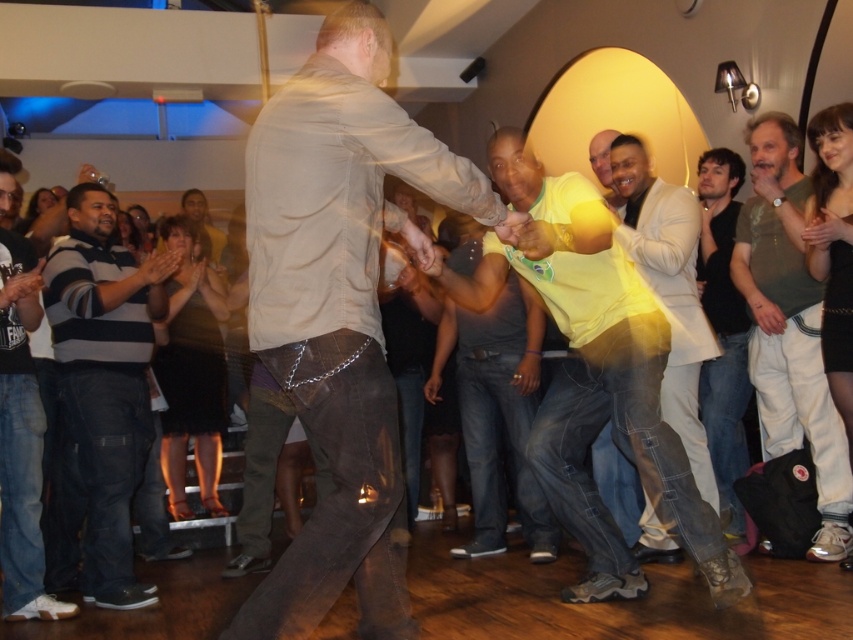
Question: Which of the following is the closest to the observer?

Choices:
 (A) (798, 259)
 (B) (595, 333)

Answer: (B)

Question: Can you confirm if light beige shirt at center is bigger than striped cotton shirt at left?

Choices:
 (A) yes
 (B) no

Answer: (A)

Question: Does light brown leather pants at right have a smaller size compared to dark blue jeans at left?

Choices:
 (A) yes
 (B) no

Answer: (A)

Question: Which point appears farthest from the camera in this image?

Choices:
 (A) (819, 513)
 (B) (361, 616)

Answer: (A)

Question: Is light beige shirt at center smaller than yellow cotton t-shirt at center?

Choices:
 (A) no
 (B) yes

Answer: (B)

Question: Which point is closer to the camera taking this photo?

Choices:
 (A) (743, 276)
 (B) (608, 403)
 (C) (651, 182)

Answer: (B)